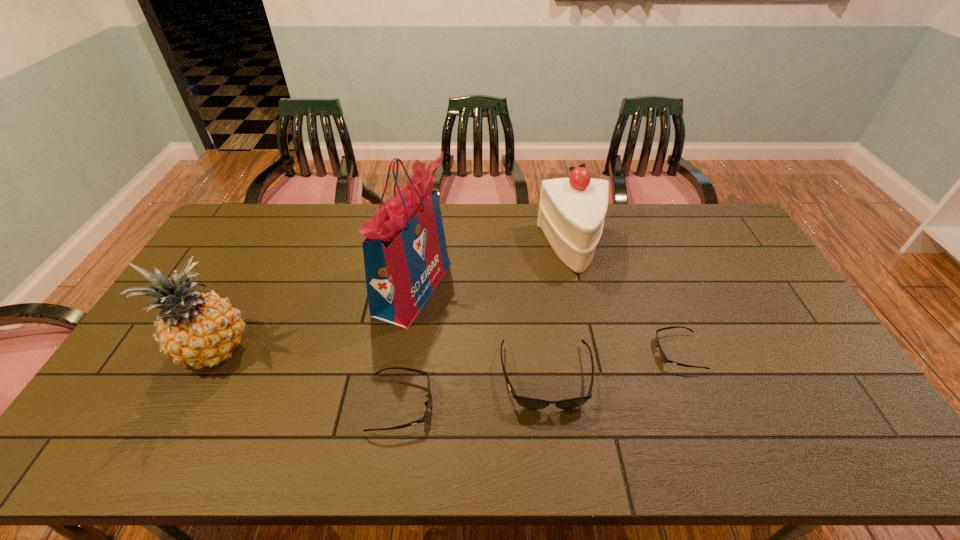
The height and width of the screenshot is (540, 960). Identify the location of free space between the fifth tallest object and the third tallest object. (487, 326).

Locate an element on the screen. Image resolution: width=960 pixels, height=540 pixels. vacant area that lies between the shortest object and the fourth shortest object is located at coordinates (626, 300).

I want to click on vacant space in between the grocery bag and the cake, so click(x=493, y=268).

This screenshot has width=960, height=540. I want to click on free space that is in between the pineapple and the rightmost sunglasses, so click(446, 352).

Identify the location of object that is the fifth nearest to the tallest object. This screenshot has width=960, height=540. tap(663, 357).

This screenshot has height=540, width=960. Identify the location of object that stands as the closest to the second tallest object. (405, 255).

Where is `sunglasses that is the second nearest to the third shortest object`? sunglasses that is the second nearest to the third shortest object is located at coordinates (663, 357).

Find the location of `sunglasses that is the closest to the fifth shortest object`. sunglasses that is the closest to the fifth shortest object is located at coordinates (422, 420).

Where is `vacant region that satisfies the following two spatial constraints: 1. on the front-facing side of the third shortest object; 2. on the front-facing side of the second tallest sunglasses`? The width and height of the screenshot is (960, 540). vacant region that satisfies the following two spatial constraints: 1. on the front-facing side of the third shortest object; 2. on the front-facing side of the second tallest sunglasses is located at coordinates (549, 404).

You are a GUI agent. You are given a task and a screenshot of the screen. Output one action in this format:
    pyautogui.click(x=<x>, y=<y>)
    Task: Click on the vacant space that satisfies the following two spatial constraints: 1. on the front-facing side of the tallest sunglasses; 2. on the front-facing side of the leftmost sunglasses
    This screenshot has height=540, width=960.
    Given the screenshot: What is the action you would take?
    pyautogui.click(x=549, y=404)